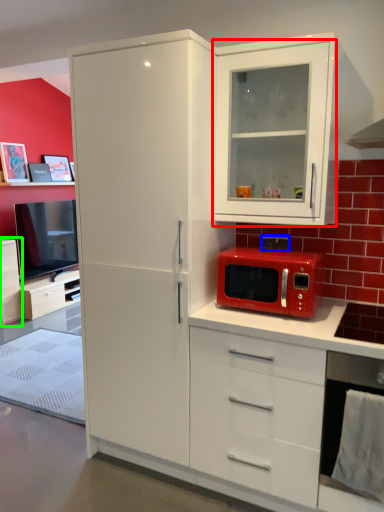
Question: Which object is positioned closest to cabinetry (highlighted by a red box)? Select from corded phone (highlighted by a blue box) and cabinetry (highlighted by a green box).

Choices:
 (A) corded phone
 (B) cabinetry

Answer: (A)